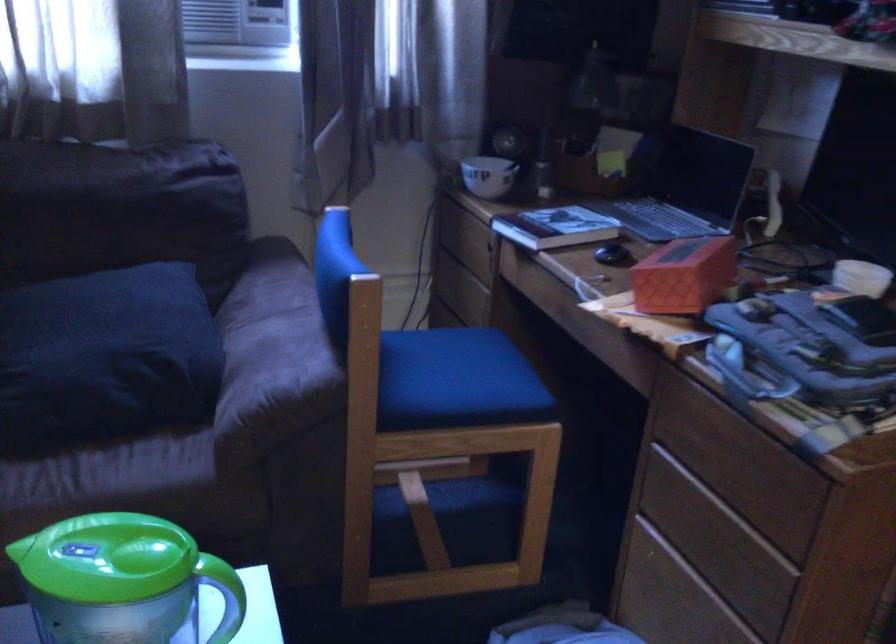
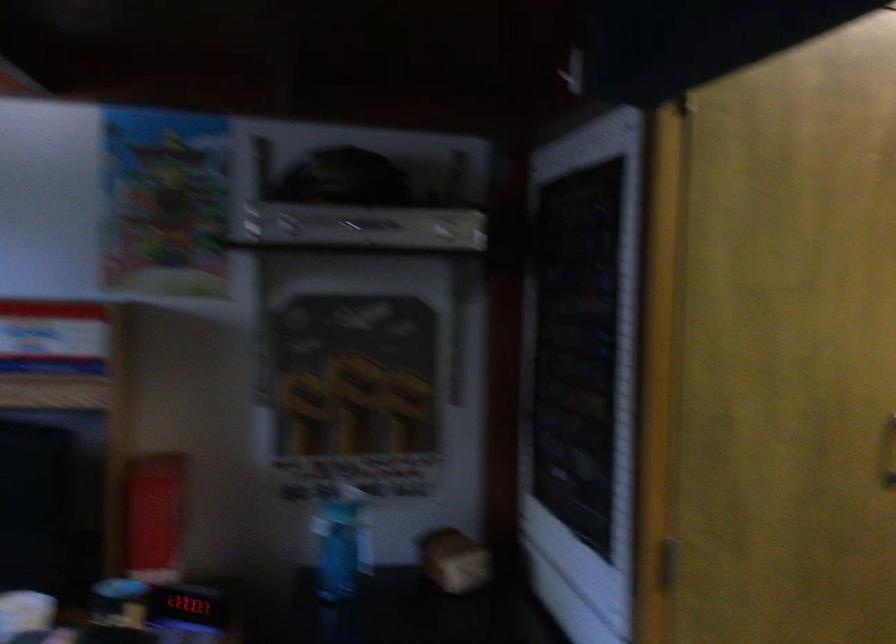
Question: How did the camera likely rotate?

Choices:
 (A) Left
 (B) Right
 (C) Up
 (D) Down

Answer: (B)